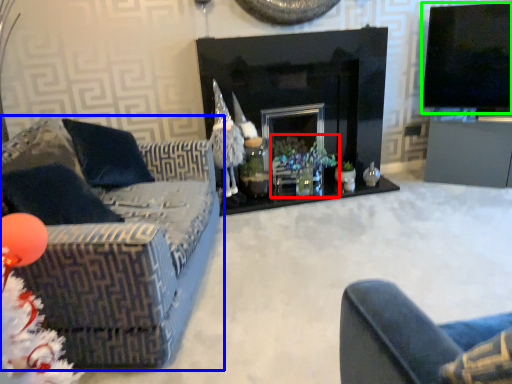
Question: Considering the real-world distances, which object is farthest from christmas decoration (highlighted by a red box)? studio couch (highlighted by a blue box) or television (highlighted by a green box)?

Choices:
 (A) studio couch
 (B) television

Answer: (B)